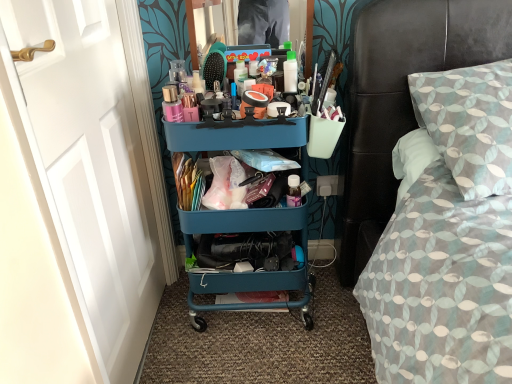
I want to click on vacant space to the right of white painted wood door at left, so click(236, 357).